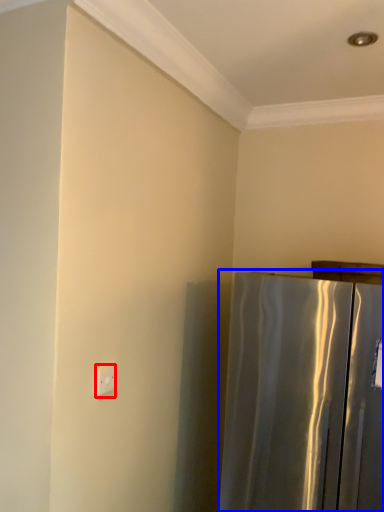
Question: Which of the following is the farthest to the observer, electric outlet (highlighted by a red box) or refrigerator (highlighted by a blue box)?

Choices:
 (A) electric outlet
 (B) refrigerator

Answer: (A)